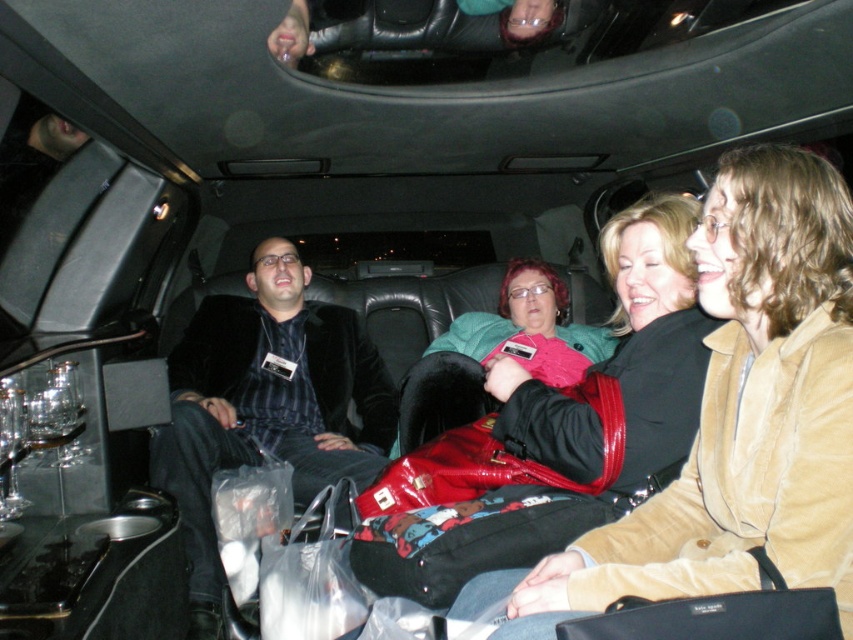
You are a passenger in the limousine and want to hand a document to the person wearing the velvet brown jacket at center without disturbing the person in the velvet black jacket at center. How should you position yourself to do this?

Since the velvet brown jacket at center is to the right of the velvet black jacket at center, you should move to the right side of the velvet black jacket at center to hand the document to the velvet brown jacket at center without disturbing them.

You are a passenger in the limousine and need to place your velvet brown jacket at center on the seat. Given the coordinates provided, can you confirm if the jacket is positioned in the center of the limousine?

The velvet brown jacket at center is located at point [741,412], which means it is positioned slightly to the right and lower part of the limousine, not exactly at the center.